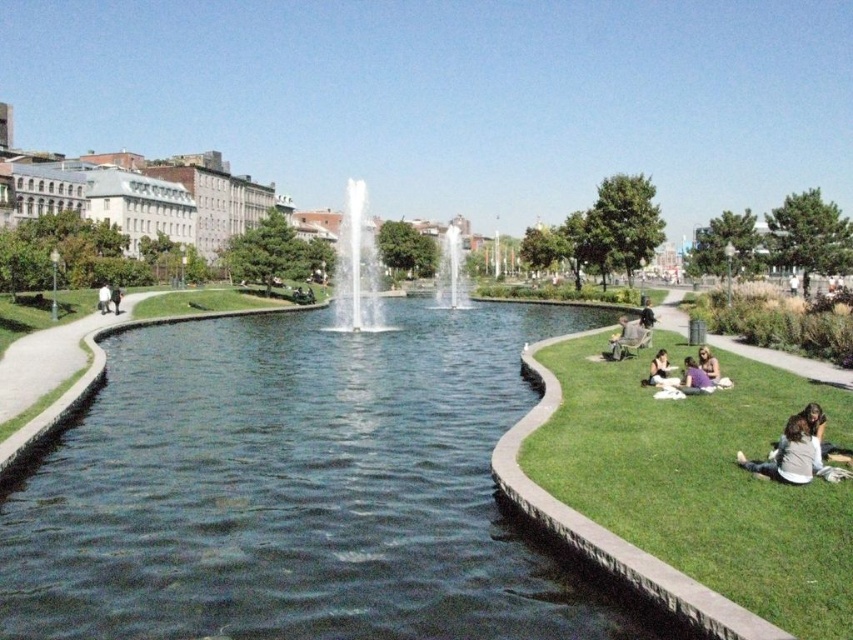
Based on the photo, can you confirm if light brown hair at lower right is taller than dark gray jacket at center?

Incorrect, light brown hair at lower right's height is not larger of dark gray jacket at center's.

Between point (704, 369) and point (648, 304), which one is positioned in front?

Point (704, 369)

Who is more forward, (x=704, y=346) or (x=653, y=320)?

Point (x=704, y=346)

The image size is (853, 640). In order to click on light brown hair at lower right in this screenshot , I will do `click(708, 364)`.

Is clear glass water at center closer to the viewer compared to dark brown hair at lower right?

No, it is behind dark brown hair at lower right.

Between point (447, 236) and point (665, 380), which one is positioned behind?

The point (447, 236) is behind.

Identify the location of clear glass water at center. The width and height of the screenshot is (853, 640). tap(451, 269).

Locate an element on the screen. The height and width of the screenshot is (640, 853). clear glass water at center is located at coordinates (451, 269).

Can you confirm if green grass at lower right is smaller than white glossy fountain at center?

Correct, green grass at lower right occupies less space than white glossy fountain at center.

Which is behind, point (831, 595) or point (352, 317)?

Positioned behind is point (352, 317).

Which is behind, point (780, 595) or point (347, 314)?

The point (347, 314) is behind.

The width and height of the screenshot is (853, 640). Identify the location of green grass at lower right. (703, 481).